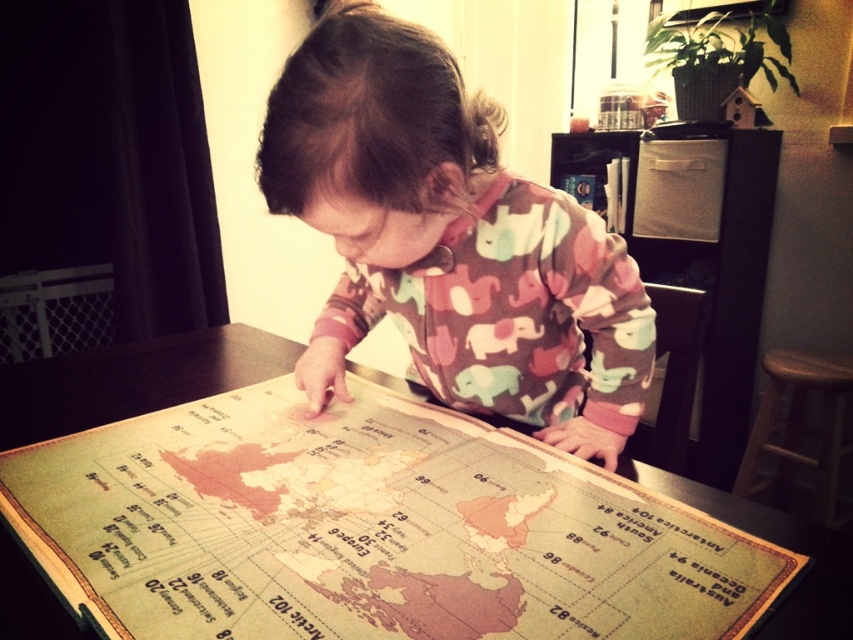
Does multicolored elephant pajamas at center come in front of brown wooden stool at lower right?

That is True.

Is point (437, 152) behind point (793, 385)?

That is False.

Identify the location of multicolored elephant pajamas at center. This screenshot has height=640, width=853. (450, 240).

Which is above, vintage paper map at center or multicolored elephant pajamas at center?

multicolored elephant pajamas at center is above.

Can you confirm if vintage paper map at center is smaller than multicolored elephant pajamas at center?

Indeed, vintage paper map at center has a smaller size compared to multicolored elephant pajamas at center.

Between point (325, 426) and point (537, 227), which one is positioned behind?

Point (325, 426)

Find the location of `vintage paper map at center`. vintage paper map at center is located at coordinates (368, 529).

Does vintage paper map at center appear on the right side of brown wooden stool at lower right?

Incorrect, vintage paper map at center is not on the right side of brown wooden stool at lower right.

This screenshot has height=640, width=853. What do you see at coordinates (368, 529) in the screenshot? I see `vintage paper map at center` at bounding box center [368, 529].

Where is `vintage paper map at center`? This screenshot has height=640, width=853. vintage paper map at center is located at coordinates (368, 529).